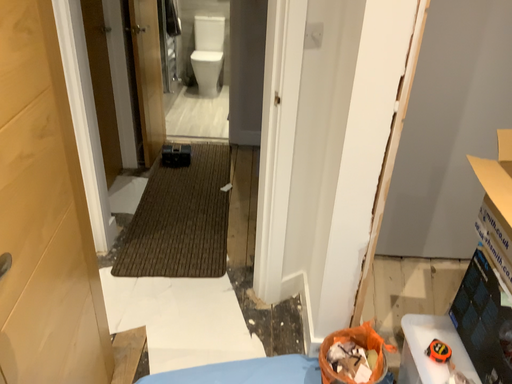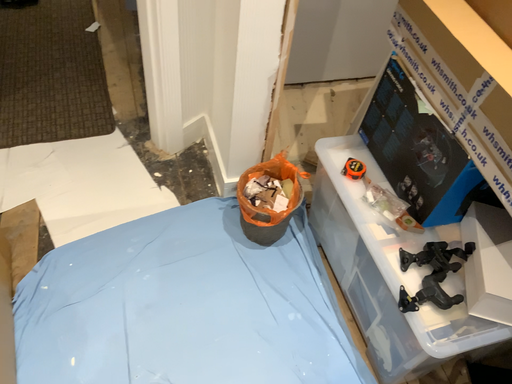
Question: Which way did the camera rotate in the video?

Choices:
 (A) rotated upward
 (B) rotated downward

Answer: (B)